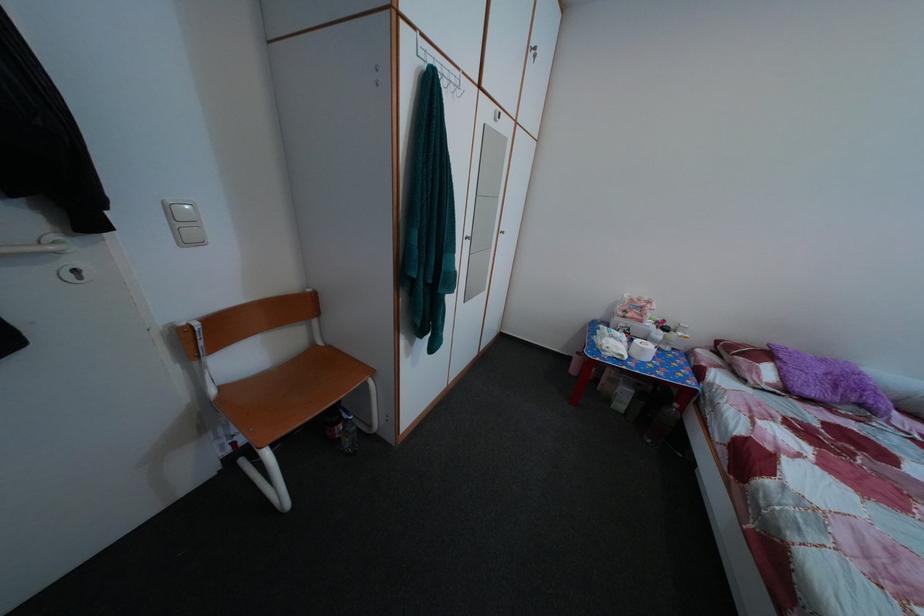
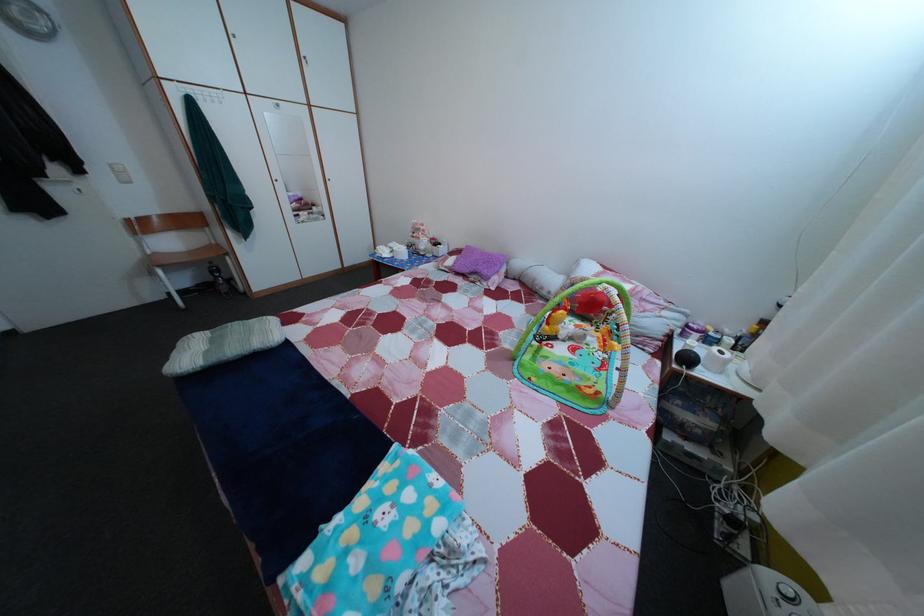
Find the pixel in the second image that matches pixel 229 395 in the first image.

(164, 261)